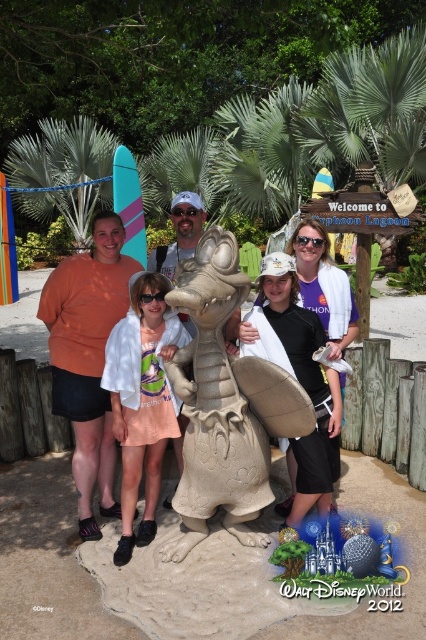
What do you see at coordinates (224, 403) in the screenshot?
I see `beige textured sand sculpture at center` at bounding box center [224, 403].

Does beige textured sand sculpture at center appear on the left side of matte sand sculpture of dragon at center?

In fact, beige textured sand sculpture at center is to the right of matte sand sculpture of dragon at center.

Between point (210, 372) and point (103, 250), which one is positioned behind?

Positioned behind is point (103, 250).

The height and width of the screenshot is (640, 426). In order to click on beige textured sand sculpture at center in this screenshot , I will do `click(224, 403)`.

Is white cotton shirt at center to the right of matte sand sculpture of dragon at center from the viewer's perspective?

Yes, white cotton shirt at center is to the right of matte sand sculpture of dragon at center.

Looking at this image, between white cotton shirt at center and matte sand sculpture of dragon at center, which one appears on the right side from the viewer's perspective?

From the viewer's perspective, white cotton shirt at center appears more on the right side.

Who is more forward, (104, 368) or (296, 232)?

Point (104, 368) is in front.

I want to click on white cotton shirt at center, so click(x=141, y=400).

Which of these two, beige textured sand sculpture at center or white cotton shirt at center, stands shorter?

With less height is white cotton shirt at center.

Which is in front, point (193, 492) or point (124, 493)?

Point (193, 492)

Identify the location of beige textured sand sculpture at center. This screenshot has height=640, width=426. (224, 403).